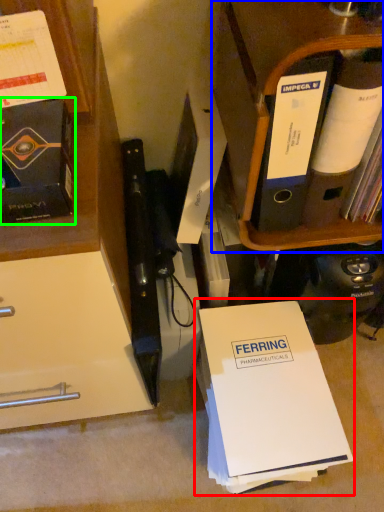
Question: Which is farther away from paperback book (highlighted by a red box)? shelf (highlighted by a blue box) or book (highlighted by a green box)?

Choices:
 (A) shelf
 (B) book

Answer: (B)